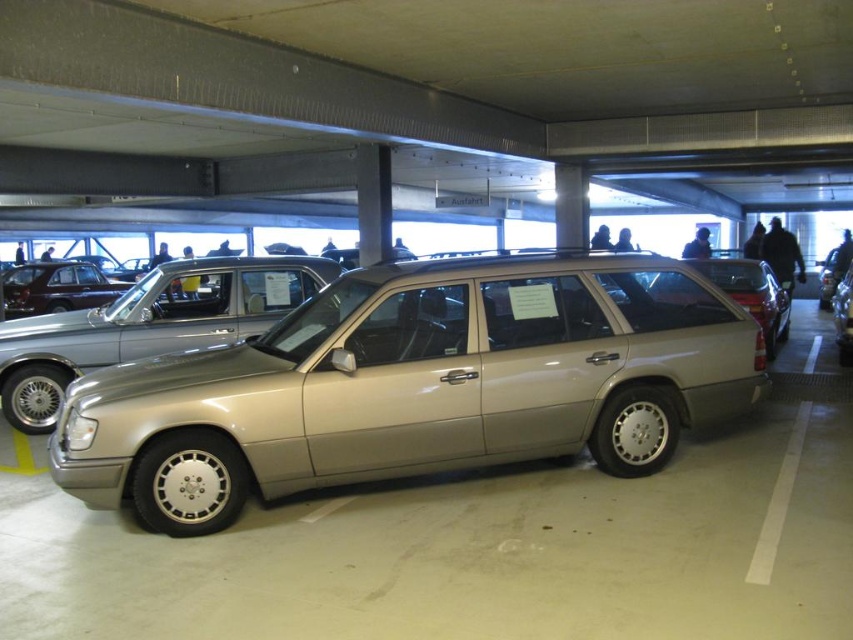
You are standing in a parking garage and see the satin gold station wagon at center. If you want to walk towards it from where you are standing, how many steps would you need to take if each step covers 2.5 feet?

The satin gold station wagon at center is 13.79 feet away. Dividing the distance by the step length of 2.5 feet gives approximately 5.516 steps. Since you can only take whole steps, you would need to take 6 steps to reach it.

You are a parking attendant who needs to fit a new car into a spot between the satin gold station wagon at center and the shiny dark brown car at center. The new car is 1.8 meters tall. Can you determine if there is enough vertical clearance between these two vehicles for the new car?

The satin gold station wagon at center is taller than the shiny dark brown car at center. Since the new car is 1.8 meters tall, you need to check the height of the shorter vehicle. However, the exact height of the shiny dark brown car at center isn